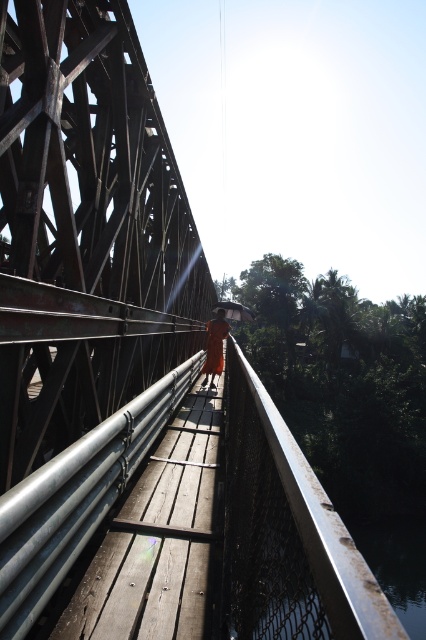
Does orange cloth at center lie in front of transparent plastic umbrella at center?

Yes, it is in front of transparent plastic umbrella at center.

Does orange cloth at center have a lesser height compared to transparent plastic umbrella at center?

In fact, orange cloth at center may be taller than transparent plastic umbrella at center.

Is point (227, 326) positioned before point (241, 316)?

Yes.

You are a GUI agent. You are given a task and a screenshot of the screen. Output one action in this format:
    pyautogui.click(x=<x>, y=<y>)
    Task: Click on the orange cloth at center
    
    Given the screenshot: What is the action you would take?
    pyautogui.click(x=215, y=348)

Is metallic silver rail at center shorter than transparent plastic umbrella at center?

Correct, metallic silver rail at center is not as tall as transparent plastic umbrella at center.

Who is higher up, metallic silver rail at center or transparent plastic umbrella at center?

transparent plastic umbrella at center is above.

Between point (259, 531) and point (236, 316), which one is positioned in front?

Point (259, 531) is in front.

Where is `metallic silver rail at center`? metallic silver rail at center is located at coordinates (287, 532).

Is rusty metal river at lower center positioned at the back of orange cloth at center?

Yes, it is.

This screenshot has width=426, height=640. What do you see at coordinates (397, 564) in the screenshot?
I see `rusty metal river at lower center` at bounding box center [397, 564].

Identify the location of rusty metal river at lower center. This screenshot has width=426, height=640. (397, 564).